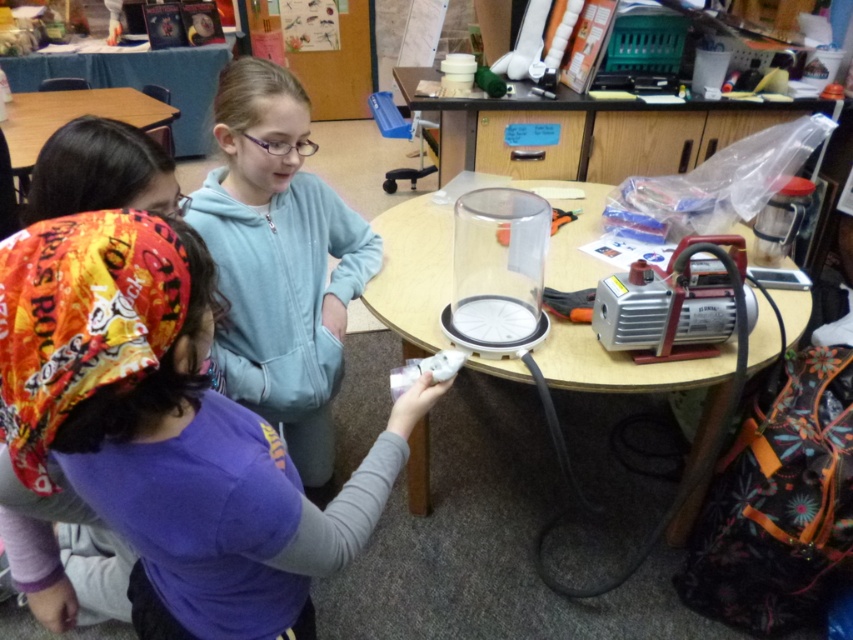
Question: Observing the image, what is the correct spatial positioning of purple fabric shirt at lower left in reference to white plastic game controller at lower center?

Choices:
 (A) right
 (B) left

Answer: (B)

Question: Is transparent plastic round table at center bigger than clear plastic table at upper center?

Choices:
 (A) no
 (B) yes

Answer: (B)

Question: Is light blue hoodie at upper center thinner than white plastic game controller at lower center?

Choices:
 (A) yes
 (B) no

Answer: (B)

Question: Which point is closer to the camera?

Choices:
 (A) light blue hoodie at upper center
 (B) white plastic game controller at lower center
 (C) clear plastic table at upper center

Answer: (A)

Question: Which point is closer to the camera taking this photo?

Choices:
 (A) (323, 376)
 (B) (408, 371)
 (C) (418, 474)

Answer: (B)

Question: Which point is closer to the camera?

Choices:
 (A) white plastic game controller at lower center
 (B) clear plastic table at upper center
 (C) transparent plastic round table at center
 (D) purple fabric shirt at lower left

Answer: (D)